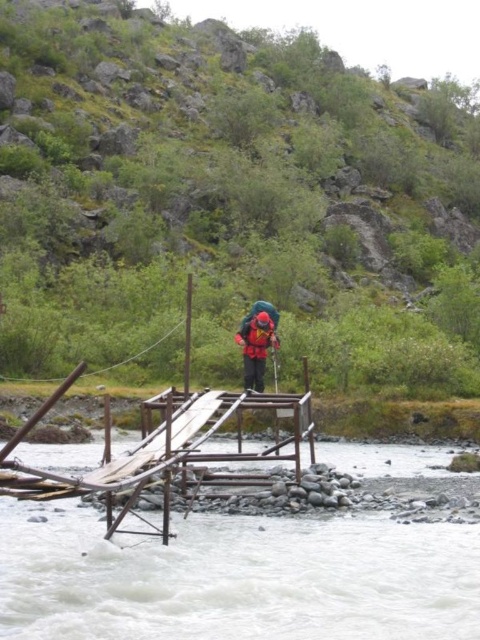
You are a hiker standing on the wooden bridge and looking down. Which object is closer to you between the white frothy water at center and the red fabric helmet at center?

The white frothy water at center is closer to the viewer than the red fabric helmet at center, so the white frothy water at center is closer to you.